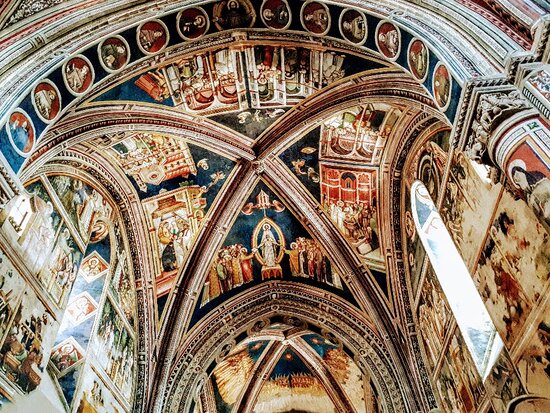
Locate an element on the screen. pillar is located at coordinates (530, 173).